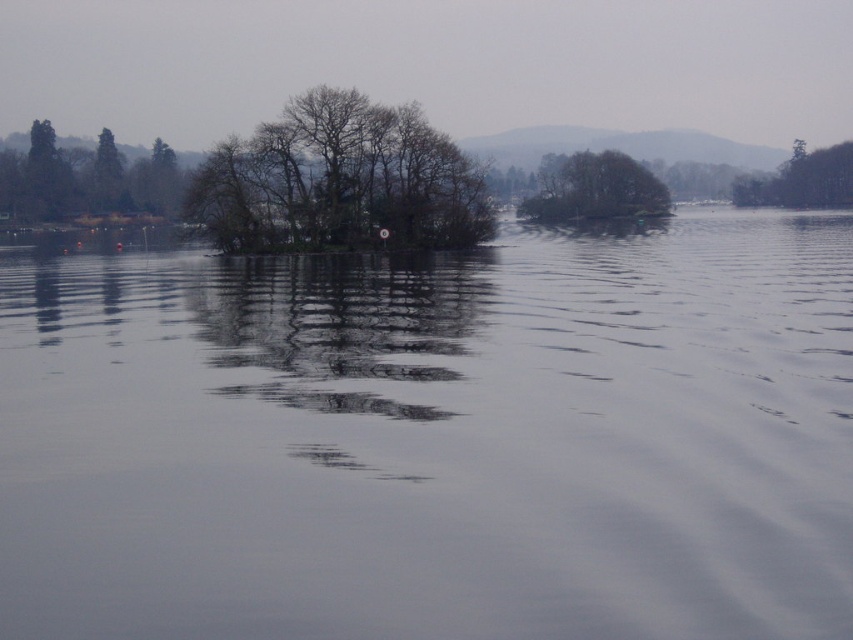
Question: Considering the relative positions of transparent water at center and green leafy tree at center in the image provided, where is transparent water at center located with respect to green leafy tree at center?

Choices:
 (A) above
 (B) below

Answer: (B)

Question: Can you confirm if transparent water at center is positioned to the left of green matte trees at upper left?

Choices:
 (A) yes
 (B) no

Answer: (B)

Question: Does bare branches island at center appear on the left side of green leafy tree at upper right?

Choices:
 (A) no
 (B) yes

Answer: (B)

Question: Estimate the real-world distances between objects in this image. Which object is farther from the green matte trees at upper left?

Choices:
 (A) bare branches island at center
 (B) transparent water at center
 (C) green leafy tree at center
 (D) green leafy tree at upper right

Answer: (B)

Question: Which is farther from the green leafy tree at upper right?

Choices:
 (A) green matte trees at upper left
 (B) green leafy tree at center

Answer: (A)

Question: Which point appears closest to the camera in this image?

Choices:
 (A) (306, 160)
 (B) (665, 189)

Answer: (A)